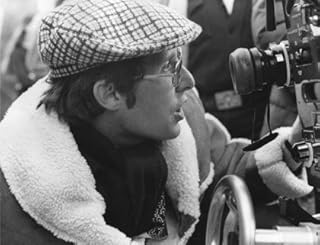
Find the location of a particular element. This screenshot has height=245, width=320. coat is located at coordinates (48, 204).